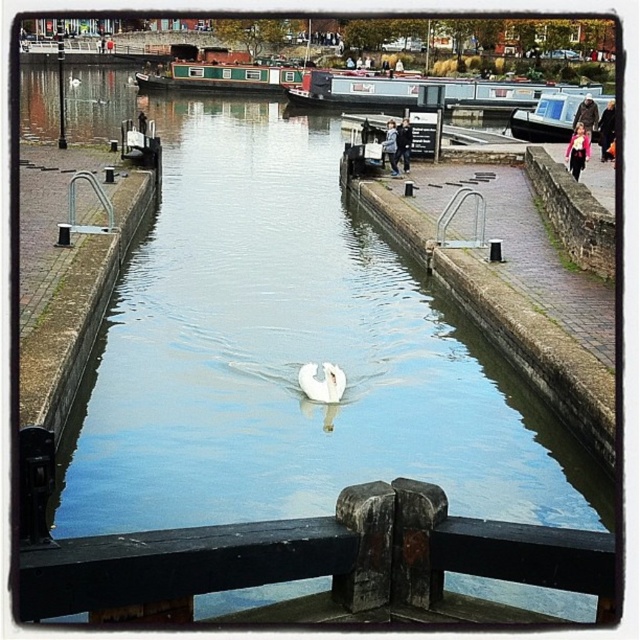
Question: Is black wood rail at center smaller than white glossy swan at center?

Choices:
 (A) yes
 (B) no

Answer: (A)

Question: Which object is farther from the camera taking this photo?

Choices:
 (A) white glossy swan at center
 (B) black wood rail at center

Answer: (A)

Question: Does black wood rail at center come behind green painted wood boat at upper center?

Choices:
 (A) yes
 (B) no

Answer: (B)

Question: Which of the following is the farthest from the observer?

Choices:
 (A) (308, 364)
 (B) (170, 70)
 (C) (545, 124)

Answer: (B)

Question: Which is nearer to the black wood rail at center?

Choices:
 (A) green wooden barge at upper center
 (B) green painted wood boat at upper center

Answer: (A)

Question: Is black wood rail at center above green wooden barge at upper center?

Choices:
 (A) yes
 (B) no

Answer: (B)